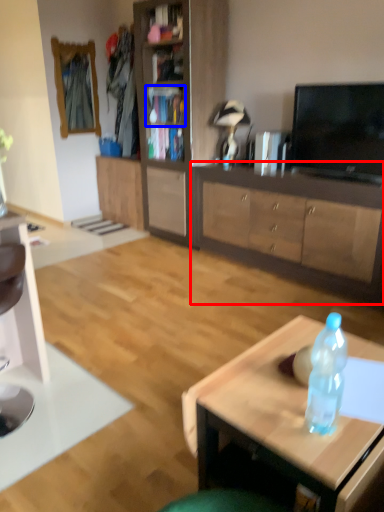
Question: Which point is further to the camera, cabinetry (highlighted by a red box) or cabinet (highlighted by a blue box)?

Choices:
 (A) cabinetry
 (B) cabinet

Answer: (B)